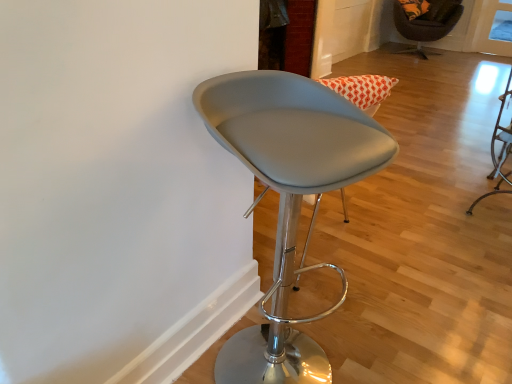
Question: Which direction should I rotate to look at satin gray stool at center, which ranks as the second chair in top-to-bottom order?

Choices:
 (A) left
 (B) right

Answer: (B)

Question: Can you confirm if velvet-like brown chair at upper right, marked as the second chair in a bottom-to-top arrangement, is positioned to the right of satin gray stool at center, placed as the first chair when sorted from bottom to top?

Choices:
 (A) yes
 (B) no

Answer: (A)

Question: Is velvet-like brown chair at upper right, the first chair from the right, aimed at satin gray stool at center, which ranks as the second chair in top-to-bottom order?

Choices:
 (A) no
 (B) yes

Answer: (B)

Question: Is velvet-like brown chair at upper right, the second chair viewed from the front, shorter than satin gray stool at center, which is the 2th chair from right to left?

Choices:
 (A) no
 (B) yes

Answer: (B)

Question: Does velvet-like brown chair at upper right, marked as the second chair in a bottom-to-top arrangement, appear on the left side of satin gray stool at center, the 1th chair positioned from the front?

Choices:
 (A) no
 (B) yes

Answer: (A)

Question: Can you confirm if velvet-like brown chair at upper right, positioned as the 1th chair in back-to-front order, is wider than satin gray stool at center, placed as the first chair when sorted from bottom to top?

Choices:
 (A) yes
 (B) no

Answer: (A)

Question: From the image's perspective, would you say velvet-like brown chair at upper right, which appears as the 1th chair when viewed from the top, is positioned over satin gray stool at center, the 1th chair positioned from the front?

Choices:
 (A) yes
 (B) no

Answer: (A)

Question: Is satin gray stool at center, the 1th chair in the left-to-right sequence, oriented away from velvet-like brown chair at upper right, which is the 2th chair from left to right?

Choices:
 (A) yes
 (B) no

Answer: (B)

Question: Is there a large distance between satin gray stool at center, arranged as the second chair when viewed from the back, and velvet-like brown chair at upper right, the first chair from the right?

Choices:
 (A) yes
 (B) no

Answer: (A)

Question: Is satin gray stool at center, placed as the first chair when sorted from bottom to top, next to velvet-like brown chair at upper right, the second chair viewed from the front?

Choices:
 (A) no
 (B) yes

Answer: (A)

Question: Is satin gray stool at center, which ranks as the second chair in top-to-bottom order, thinner than velvet-like brown chair at upper right, which is the 2th chair from left to right?

Choices:
 (A) no
 (B) yes

Answer: (B)

Question: From a real-world perspective, is satin gray stool at center, arranged as the second chair when viewed from the back, over velvet-like brown chair at upper right, which is the 2th chair from left to right?

Choices:
 (A) no
 (B) yes

Answer: (B)

Question: From the image's perspective, does satin gray stool at center, arranged as the second chair when viewed from the back, appear lower than velvet-like brown chair at upper right, the first chair from the right?

Choices:
 (A) no
 (B) yes

Answer: (B)

Question: Is point (339, 274) closer or farther from the camera than point (439, 29)?

Choices:
 (A) closer
 (B) farther

Answer: (A)